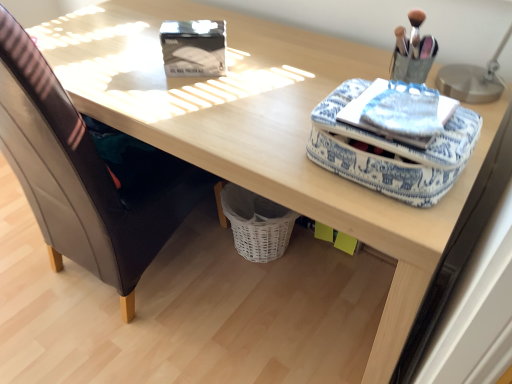
This screenshot has width=512, height=384. What are the coordinates of `unoccupied space behind matte black storage box at upper center` in the screenshot? It's located at (225, 38).